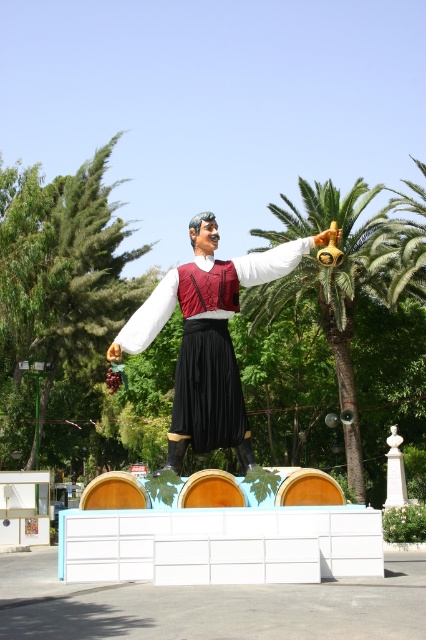
Question: In this image, where is matte black statue at center located relative to green leafy palm tree at center?

Choices:
 (A) right
 (B) left

Answer: (B)

Question: Is matte black statue at center positioned in front of green leafy palm tree at center?

Choices:
 (A) yes
 (B) no

Answer: (A)

Question: Is matte black statue at center further to the viewer compared to green leafy palm tree at center?

Choices:
 (A) no
 (B) yes

Answer: (A)

Question: Which point is farther from the camera taking this photo?

Choices:
 (A) (232, 429)
 (B) (383, 225)

Answer: (B)

Question: Which of the following is the closest to the observer?

Choices:
 (A) (227, 410)
 (B) (334, 364)

Answer: (A)